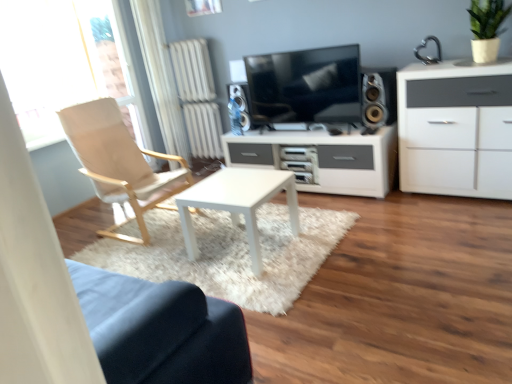
Question: Does matte black tv at center appear on the left side of white fabric curtain at left?

Choices:
 (A) yes
 (B) no

Answer: (B)

Question: From a real-world perspective, is matte black tv at center below white fabric curtain at left?

Choices:
 (A) no
 (B) yes

Answer: (B)

Question: Considering the relative sizes of matte black tv at center and white fabric curtain at left in the image provided, is matte black tv at center smaller than white fabric curtain at left?

Choices:
 (A) yes
 (B) no

Answer: (A)

Question: Is matte black tv at center looking in the opposite direction of white fabric curtain at left?

Choices:
 (A) no
 (B) yes

Answer: (A)

Question: From the image's perspective, is matte black tv at center on white fabric curtain at left?

Choices:
 (A) yes
 (B) no

Answer: (B)

Question: Is matte black tv at center shorter than white fabric curtain at left?

Choices:
 (A) no
 (B) yes

Answer: (B)

Question: Is white matte cabinet at right turned away from matte black tv at center?

Choices:
 (A) no
 (B) yes

Answer: (A)

Question: Can you confirm if white matte cabinet at right is thinner than matte black tv at center?

Choices:
 (A) yes
 (B) no

Answer: (B)

Question: Is white matte cabinet at right at the left side of matte black tv at center?

Choices:
 (A) yes
 (B) no

Answer: (B)

Question: Considering the relative sizes of white matte cabinet at right and matte black tv at center in the image provided, is white matte cabinet at right wider than matte black tv at center?

Choices:
 (A) yes
 (B) no

Answer: (A)

Question: Is white matte cabinet at right facing towards matte black tv at center?

Choices:
 (A) yes
 (B) no

Answer: (B)

Question: Considering the relative sizes of white matte cabinet at right and matte black tv at center in the image provided, is white matte cabinet at right bigger than matte black tv at center?

Choices:
 (A) yes
 (B) no

Answer: (A)

Question: Is silver metallic speaker at right, the second speaker positioned from the back, thinner than light beige fabric chair at left?

Choices:
 (A) yes
 (B) no

Answer: (A)